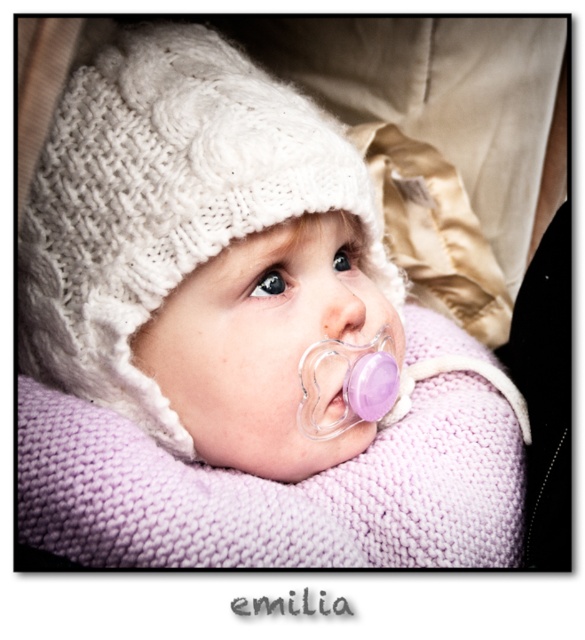
You are a photographer trying to capture a close up of the purple matte pacifier at center. Where should you focus your camera to ensure the pacifier is in the center of the frame?

The purple matte pacifier at center is located at the 2D coordinates point (342, 304), so you should focus your camera at that point to center it in the frame.

You are a photographer trying to capture the exact center of the image. You notice the point marked as point (342,304). Is this point likely to be the center of the image?

The purple matte pacifier at center is represented by point (342,304), so yes, this point is the center of the image.

You are a parent trying to choose between the purple matte pacifier at center and the purple rubber pacifier at center for your child. Based on the image, which pacifier might be more comfortable for the child if you prioritize width?

The purple matte pacifier at center might be wider than the purple rubber pacifier at center, so it could be more comfortable if width is a priority.